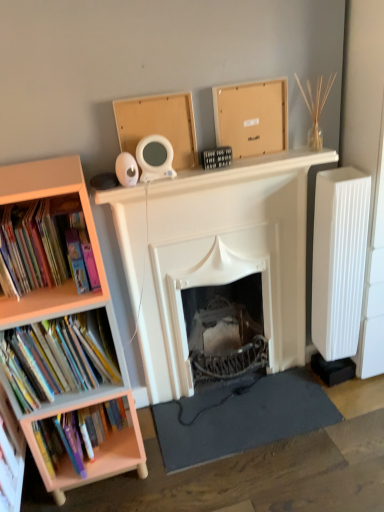
What do you see at coordinates (64, 315) in the screenshot? I see `peach wood bookcase at left` at bounding box center [64, 315].

In order to face dark gray rubber mat at lower center, should I rotate leftwards or rightwards?

A 6.772 degree turn to the right will do.

What do you see at coordinates (214, 254) in the screenshot? I see `white matte fireplace at center` at bounding box center [214, 254].

Find the location of a particular element. Image resolution: width=384 pixels, height=512 pixels. white matte fireplace at center is located at coordinates (214, 254).

The image size is (384, 512). Find the location of `matte cardboard box at upper center, arranged as the 1th cardboard box when viewed from the right`. matte cardboard box at upper center, arranged as the 1th cardboard box when viewed from the right is located at coordinates (252, 117).

In the scene shown: How much space does matte cardboard box at upper center, the 2th cardboard box viewed from the left, occupy vertically?

25.13 centimeters.

Locate an element on the screen. white ribbed radiator at right is located at coordinates pos(339,260).

Is matte cardboard bookshelf at left, acting as the first book starting from the top, wider than matte cardboard box at upper center, which ranks as the 2th cardboard box in right-to-left order?

Yes.

Considering the positions of objects matte cardboard bookshelf at left, marked as the third book in a bottom-to-top arrangement, and matte cardboard box at upper center, which ranks as the 2th cardboard box in right-to-left order, in the image provided, who is in front, matte cardboard bookshelf at left, marked as the third book in a bottom-to-top arrangement, or matte cardboard box at upper center, which ranks as the 2th cardboard box in right-to-left order,?

matte cardboard bookshelf at left, marked as the third book in a bottom-to-top arrangement, is closer to the camera.

Is matte cardboard bookshelf at left, marked as the third book in a bottom-to-top arrangement, next to matte cardboard box at upper center, which ranks as the 2th cardboard box in right-to-left order?

matte cardboard bookshelf at left, marked as the third book in a bottom-to-top arrangement, and matte cardboard box at upper center, which ranks as the 2th cardboard box in right-to-left order, are clearly separated.

Between matte cardboard bookshelf at left, acting as the first book starting from the top, and matte cardboard box at upper center, which ranks as the 2th cardboard box in right-to-left order, which one appears on the left side from the viewer's perspective?

matte cardboard bookshelf at left, acting as the first book starting from the top, is more to the left.

Considering the relative positions of peach wood bookcase at left and matte cardboard box at upper center, arranged as the 1th cardboard box when viewed from the right, in the image provided, is peach wood bookcase at left to the left of matte cardboard box at upper center, arranged as the 1th cardboard box when viewed from the right, from the viewer's perspective?

Yes, peach wood bookcase at left is to the left of matte cardboard box at upper center, arranged as the 1th cardboard box when viewed from the right.

Can you confirm if peach wood bookcase at left is thinner than matte cardboard box at upper center, arranged as the 1th cardboard box when viewed from the right?

No, peach wood bookcase at left is not thinner than matte cardboard box at upper center, arranged as the 1th cardboard box when viewed from the right.

Is peach wood bookcase at left oriented towards matte cardboard box at upper center, arranged as the 1th cardboard box when viewed from the right?

No, peach wood bookcase at left is not turned towards matte cardboard box at upper center, arranged as the 1th cardboard box when viewed from the right.

Is the depth of peach wood bookcase at left less than that of matte cardboard box at upper center, arranged as the 1th cardboard box when viewed from the right?

Yes, it is in front of matte cardboard box at upper center, arranged as the 1th cardboard box when viewed from the right.

Would you say hardcover books at left, the second book when ordered from top to bottom, is outside hardcover books at left, the 3th book in the top-to-bottom sequence?

That's correct, hardcover books at left, the second book when ordered from top to bottom, is outside of hardcover books at left, the 3th book in the top-to-bottom sequence.

Considering the positions of point (94, 343) and point (106, 422), is point (94, 343) closer or farther from the camera than point (106, 422)?

Point (94, 343) is closer to the camera than point (106, 422).

Considering the sizes of objects hardcover books at left, the second book when ordered from top to bottom, and hardcover books at left, the 3th book in the top-to-bottom sequence, in the image provided, who is thinner, hardcover books at left, the second book when ordered from top to bottom, or hardcover books at left, the 3th book in the top-to-bottom sequence,?

Thinner between the two is hardcover books at left, the second book when ordered from top to bottom.

From the image's perspective, relative to hardcover books at left, which is counted as the 1th book, starting from the bottom, is hardcover books at left, the second book from the bottom, above or below?

From the image's perspective, hardcover books at left, the second book from the bottom, appears above hardcover books at left, which is counted as the 1th book, starting from the bottom.

Can you tell me how much white ribbed radiator at right and peach wood bookcase at left differ in facing direction?

There is a 3.24-degree angle between the facing directions of white ribbed radiator at right and peach wood bookcase at left.

Which object is positioned more to the left, white ribbed radiator at right or peach wood bookcase at left?

Positioned to the left is peach wood bookcase at left.

Between white ribbed radiator at right and peach wood bookcase at left, which one is positioned in front?

peach wood bookcase at left is closer to the camera.

Does point (344, 334) appear closer or farther from the camera than point (87, 221)?

Clearly, point (344, 334) is more distant from the camera than point (87, 221).

From a real-world perspective, is white ribbed radiator at right positioned over dark gray rubber mat at lower center based on gravity?

Yes, from a real-world perspective, white ribbed radiator at right is over dark gray rubber mat at lower center

Between white ribbed radiator at right and dark gray rubber mat at lower center, which one appears on the left side from the viewer's perspective?

dark gray rubber mat at lower center.

Can you see white ribbed radiator at right touching dark gray rubber mat at lower center?

No, white ribbed radiator at right is not beside dark gray rubber mat at lower center.

Looking at this image, is dark gray rubber mat at lower center oriented away from white ribbed radiator at right?

No, dark gray rubber mat at lower center is not facing away from white ribbed radiator at right.

Does dark gray rubber mat at lower center have a greater height compared to white ribbed radiator at right?

No, dark gray rubber mat at lower center is not taller than white ribbed radiator at right.

Is dark gray rubber mat at lower center closer to camera compared to white ribbed radiator at right?

No, dark gray rubber mat at lower center is further to the viewer.

Which point is more distant from viewer, (252, 394) or (334, 206)?

The point (252, 394) is behind.

Based on the photo, is matte cardboard box at upper center, which ranks as the 2th cardboard box in right-to-left order, far away from hardcover books at left, the second book when ordered from top to bottom?

Actually, matte cardboard box at upper center, which ranks as the 2th cardboard box in right-to-left order, and hardcover books at left, the second book when ordered from top to bottom, are a little close together.

How many degrees apart are the facing directions of matte cardboard box at upper center, marked as the 1th cardboard box in a left-to-right arrangement, and hardcover books at left, the second book when ordered from top to bottom?

They differ by 0.231 degrees in their facing directions.

In the scene shown: Looking at the image, does matte cardboard box at upper center, which ranks as the 2th cardboard box in right-to-left order, seem bigger or smaller compared to hardcover books at left, the second book from the bottom?

In the image, matte cardboard box at upper center, which ranks as the 2th cardboard box in right-to-left order, appears to be smaller than hardcover books at left, the second book from the bottom.

Is point (127, 133) positioned before point (76, 338)?

No, it is not.

From a real-world perspective, which book is the 1st one underneath the matte cardboard box at upper center, which ranks as the 2th cardboard box in right-to-left order? Please provide its 2D coordinates.

[(41, 249)]

At what (x,y) coordinates should I click in order to perform the action: click on the 2nd cardboard box located above the peach wood bookcase at left (from a real-world perspective). Please return your answer as a coordinate pair (x, y). The height and width of the screenshot is (512, 384). Looking at the image, I should click on (252, 117).

Based on their spatial positions, is matte cardboard bookshelf at left, marked as the third book in a bottom-to-top arrangement, or matte cardboard box at upper center, arranged as the 1th cardboard box when viewed from the right, closer to peach wood bookcase at left?

matte cardboard bookshelf at left, marked as the third book in a bottom-to-top arrangement, lies closer to peach wood bookcase at left than the other object.

Based on their spatial positions, is matte cardboard box at upper center, marked as the 1th cardboard box in a left-to-right arrangement, or white ribbed radiator at right further from hardcover books at left, which is counted as the 1th book, starting from the bottom?

white ribbed radiator at right is positioned further to the anchor hardcover books at left, which is counted as the 1th book, starting from the bottom.

Estimate the real-world distances between objects in this image. Which object is closer to hardcover books at left, the second book from the bottom, hardcover books at left, the 3th book in the top-to-bottom sequence, or matte cardboard box at upper center, arranged as the 1th cardboard box when viewed from the right?

The object closer to hardcover books at left, the second book from the bottom, is hardcover books at left, the 3th book in the top-to-bottom sequence.

From the image, which object appears to be farther from white matte fireplace at center, matte cardboard bookshelf at left, acting as the first book starting from the top, or dark gray rubber mat at lower center?

matte cardboard bookshelf at left, acting as the first book starting from the top, lies further to white matte fireplace at center than the other object.

Looking at the image, which one is located further to hardcover books at left, the second book from the bottom, matte cardboard box at upper center, the 2th cardboard box viewed from the left, or peach wood bookcase at left?

Among the two, matte cardboard box at upper center, the 2th cardboard box viewed from the left, is located further to hardcover books at left, the second book from the bottom.

Estimate the real-world distances between objects in this image. Which object is closer to hardcover books at left, the second book when ordered from top to bottom, white matte fireplace at center or matte cardboard bookshelf at left, acting as the first book starting from the top?

matte cardboard bookshelf at left, acting as the first book starting from the top, is positioned closer to the anchor hardcover books at left, the second book when ordered from top to bottom.

From the image, which object appears to be nearer to white matte fireplace at center, white ribbed radiator at right or dark gray rubber mat at lower center?

The object closer to white matte fireplace at center is white ribbed radiator at right.

Based on their spatial positions, is white ribbed radiator at right or matte cardboard bookshelf at left, acting as the first book starting from the top, further from dark gray rubber mat at lower center?

matte cardboard bookshelf at left, acting as the first book starting from the top.

Locate an element on the screen. The image size is (384, 512). cardboard box located between matte cardboard box at upper center, marked as the 1th cardboard box in a left-to-right arrangement, and white ribbed radiator at right in the left-right direction is located at coordinates (252, 117).

This screenshot has width=384, height=512. Find the location of `fireplace between matte cardboard bookshelf at left, acting as the first book starting from the top, and dark gray rubber mat at lower center, in the vertical direction`. fireplace between matte cardboard bookshelf at left, acting as the first book starting from the top, and dark gray rubber mat at lower center, in the vertical direction is located at coordinates (214, 254).

The height and width of the screenshot is (512, 384). I want to click on cardboard box between matte cardboard box at upper center, arranged as the 1th cardboard box when viewed from the right, and peach wood bookcase at left from top to bottom, so click(159, 125).

Find the location of `bookcase between hardcover books at left, the second book when ordered from top to bottom, and dark gray rubber mat at lower center from left to right`. bookcase between hardcover books at left, the second book when ordered from top to bottom, and dark gray rubber mat at lower center from left to right is located at coordinates (64, 315).